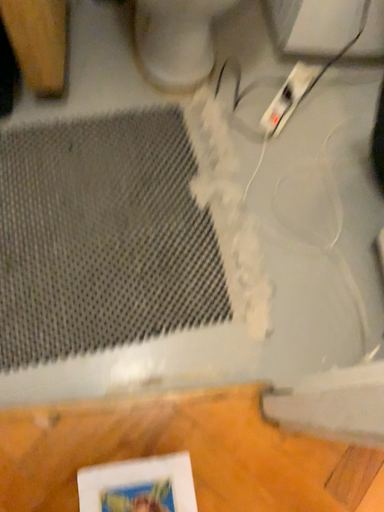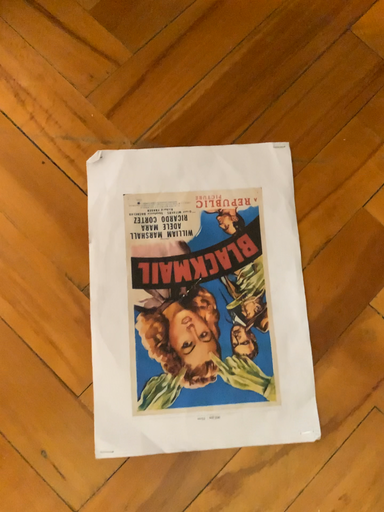
Question: Which way did the camera rotate in the video?

Choices:
 (A) rotated left
 (B) rotated right

Answer: (B)